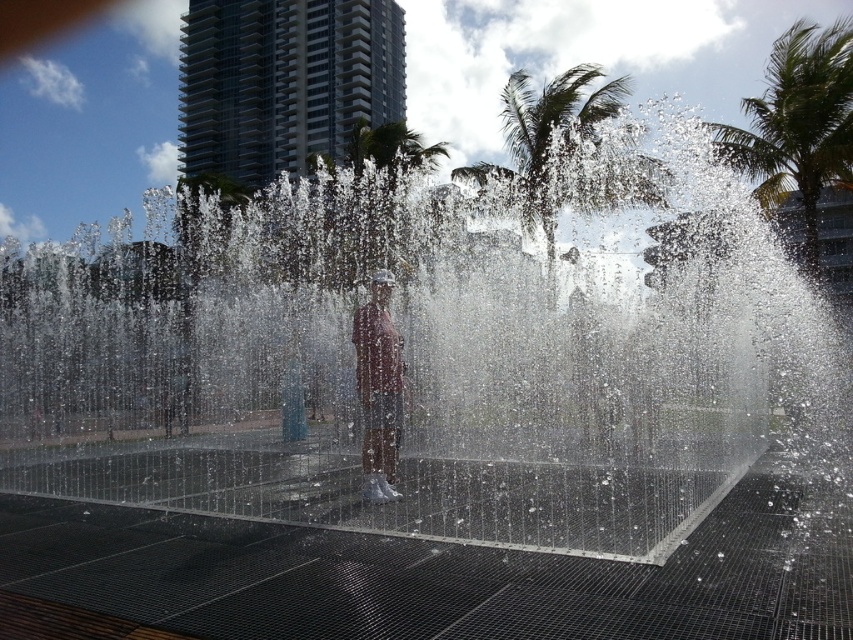
You are a photographer trying to capture the entire fountain and the person standing in it. You notice two points marked in the scene. Which of the two points, point (x=756, y=120) or point (x=375, y=403), is closer to your camera lens?

Point (x=375, y=403) is closer to the camera lens because it is less further away than point (x=756, y=120), which is positioned further away from the camera.

You are standing in the urban scene with the large modern water fountain. You want to locate the green leafy palm tree at upper right. Where is it positioned in the image?

The green leafy palm tree at upper right is located at point (798, 124) in the image.